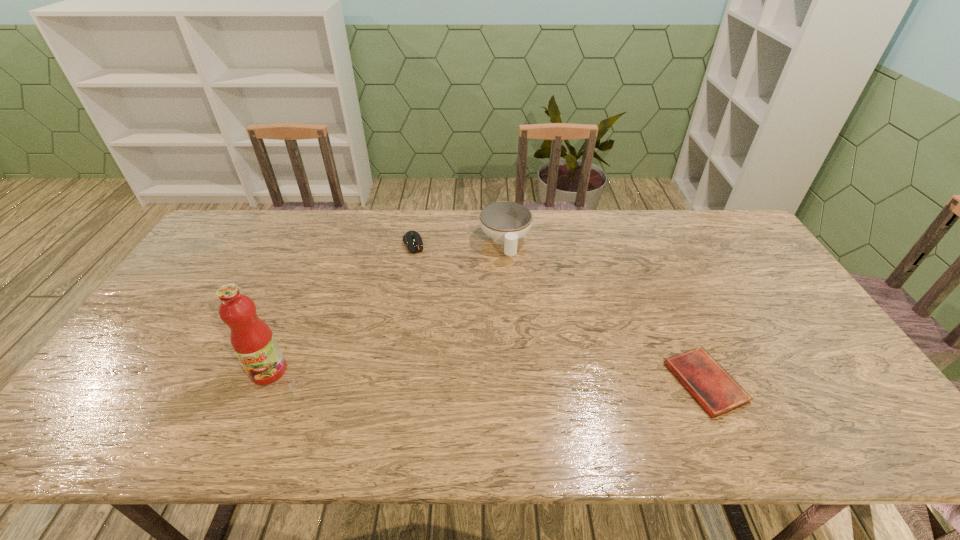
Where is `free spot on the desktop that is between the leftmost object and the rightmost object and is positioned on the button of the computer equipment`? This screenshot has height=540, width=960. free spot on the desktop that is between the leftmost object and the rightmost object and is positioned on the button of the computer equipment is located at coordinates (459, 376).

The width and height of the screenshot is (960, 540). In order to click on free space on the desktop that is between the leftmost object and the shortest object and is positioned on the side with the handle of the third object from left to right in this screenshot , I will do (536, 378).